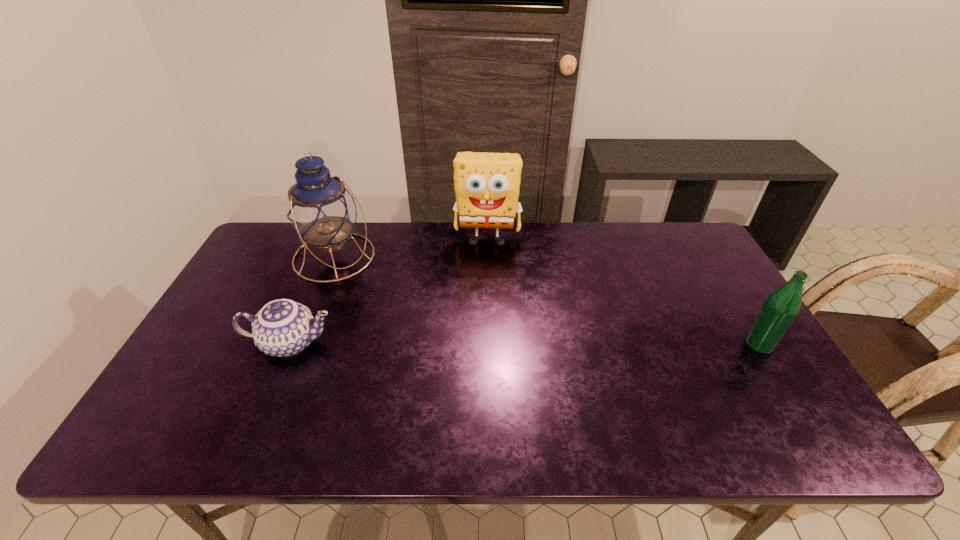
At what (x,y) coordinates should I click in order to perform the action: click on vacant space located 0.050m on the face of the third shortest object. Please return your answer as a coordinate pair (x, y). This screenshot has height=540, width=960. Looking at the image, I should click on (486, 265).

You are a GUI agent. You are given a task and a screenshot of the screen. Output one action in this format:
    pyautogui.click(x=<x>, y=<y>)
    Task: Click on the vacant space located on the front-facing side of the tallest object
    
    Given the screenshot: What is the action you would take?
    pyautogui.click(x=369, y=281)

The image size is (960, 540). I want to click on vacant space located 0.290m on the front-facing side of the tallest object, so click(423, 319).

Where is `vacant space located on the front-facing side of the tallest object`? vacant space located on the front-facing side of the tallest object is located at coordinates [x=409, y=309].

Locate an element on the screen. Image resolution: width=960 pixels, height=540 pixels. sponge that is at the far edge is located at coordinates pyautogui.click(x=487, y=185).

You are a GUI agent. You are given a task and a screenshot of the screen. Output one action in this format:
    pyautogui.click(x=<x>, y=<y>)
    Task: Click on the lantern located at the far edge
    
    Given the screenshot: What is the action you would take?
    pyautogui.click(x=320, y=209)

Where is `chinaware that is at the left edge`? The width and height of the screenshot is (960, 540). chinaware that is at the left edge is located at coordinates 283,327.

Identify the location of lantern that is at the left edge. (320, 209).

This screenshot has height=540, width=960. What are the coordinates of `object positioned at the right edge` in the screenshot? It's located at (780, 309).

Locate an element on the screen. The width and height of the screenshot is (960, 540). object located at the far left corner is located at coordinates (320, 209).